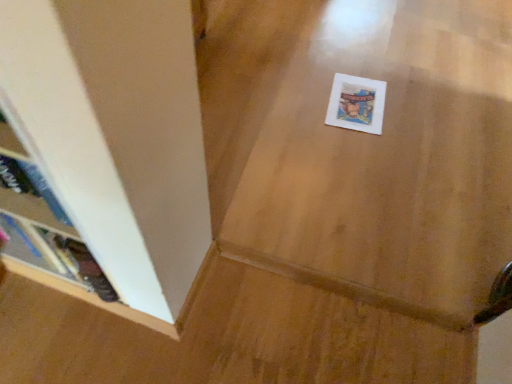
Image resolution: width=512 pixels, height=384 pixels. Identify the location of free point to the right of white paper postcard at center. (416, 109).